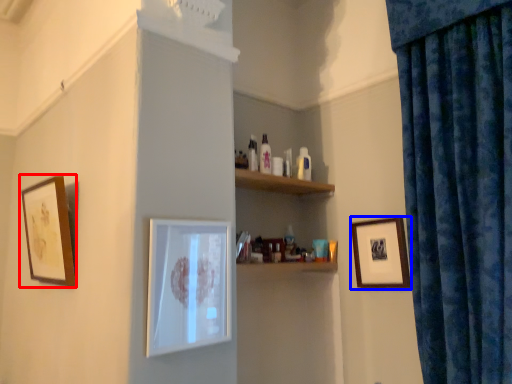
Question: Among these objects, which one is nearest to the camera, picture frame (highlighted by a red box) or picture frame (highlighted by a blue box)?

Choices:
 (A) picture frame
 (B) picture frame

Answer: (A)